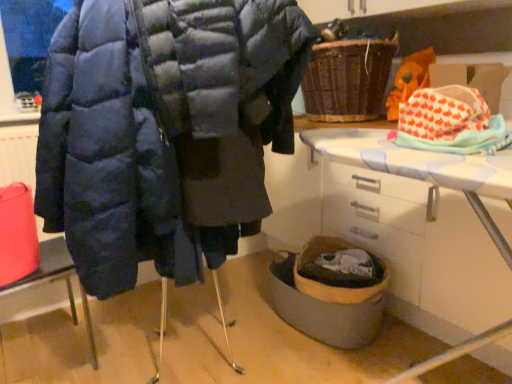
This screenshot has height=384, width=512. What are the coordinates of `blank area beneath matte black coat at left (from a real-world perspective)` in the screenshot? It's located at (41, 353).